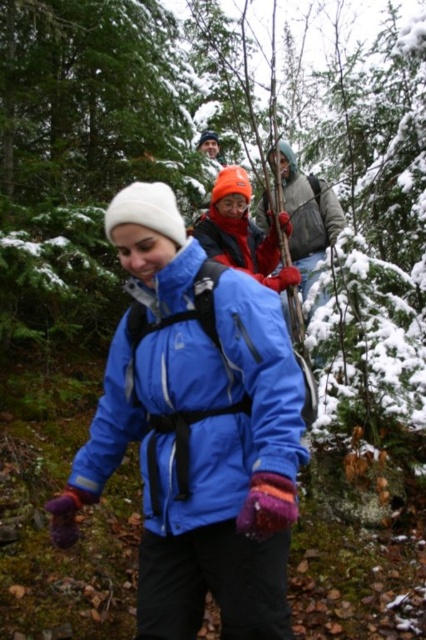
Question: Is blue synthetic jacket at center positioned in front of red fleece jacket at center?

Choices:
 (A) no
 (B) yes

Answer: (B)

Question: Is gray fleece jacket at center in front of red fleece jacket at center?

Choices:
 (A) yes
 (B) no

Answer: (B)

Question: Can you confirm if gray fleece jacket at center is positioned below red fleece jacket at center?

Choices:
 (A) no
 (B) yes

Answer: (A)

Question: Which of these objects is positioned farthest from the red fleece jacket at center?

Choices:
 (A) blue synthetic jacket at center
 (B) gray fleece jacket at center

Answer: (A)

Question: Among these points, which one is nearest to the camera?

Choices:
 (A) (293, 397)
 (B) (294, 173)

Answer: (A)

Question: Estimate the real-world distances between objects in this image. Which object is closer to the blue synthetic jacket at center?

Choices:
 (A) red fleece jacket at center
 (B) gray fleece jacket at center

Answer: (A)